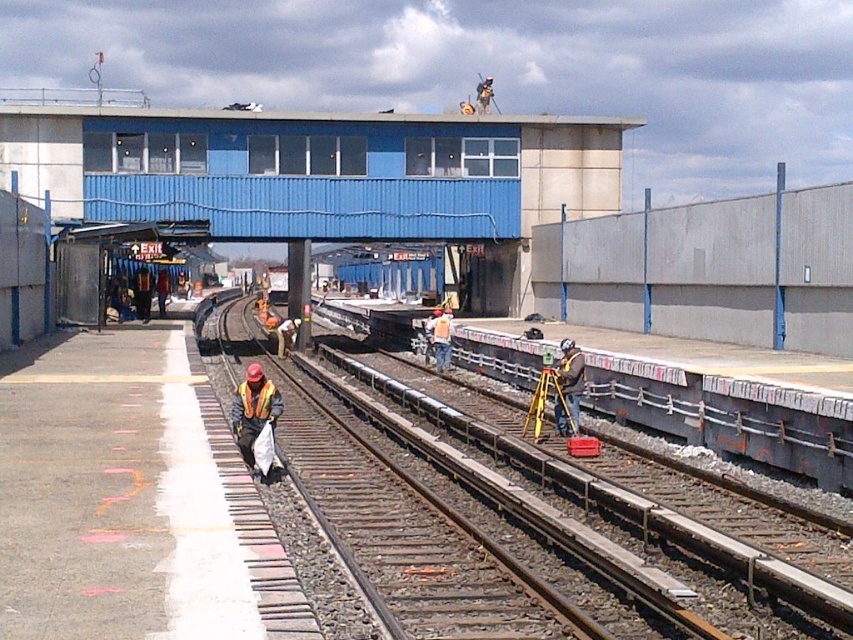
Is point (555, 504) positioned after point (254, 432)?

Yes, point (555, 504) is behind point (254, 432).

From the picture: Does brown metallic train track at center appear under reflective orange vest at center?

Indeed, brown metallic train track at center is positioned under reflective orange vest at center.

The height and width of the screenshot is (640, 853). Find the location of `brown metallic train track at center`. brown metallic train track at center is located at coordinates (544, 508).

This screenshot has height=640, width=853. In order to click on brown metallic train track at center in this screenshot , I will do `click(544, 508)`.

Which is more to the right, reflective orange vest at center or orange reflective safety vest at lower center?

orange reflective safety vest at lower center

Where is `reflective orange vest at center`? reflective orange vest at center is located at coordinates (253, 410).

Measure the distance between point [252,428] and camera.

Point [252,428] and camera are 12.75 meters apart.

Image resolution: width=853 pixels, height=640 pixels. Identify the location of reflective orange vest at center. (253, 410).

Looking at this image, can you confirm if orange reflective vest at center is wider than reflective safety vest at center?

No.

Is orange reflective vest at center above reflective safety vest at center?

Actually, orange reflective vest at center is below reflective safety vest at center.

What do you see at coordinates (440, 337) in the screenshot?
I see `orange reflective vest at center` at bounding box center [440, 337].

The height and width of the screenshot is (640, 853). I want to click on orange reflective vest at center, so click(x=440, y=337).